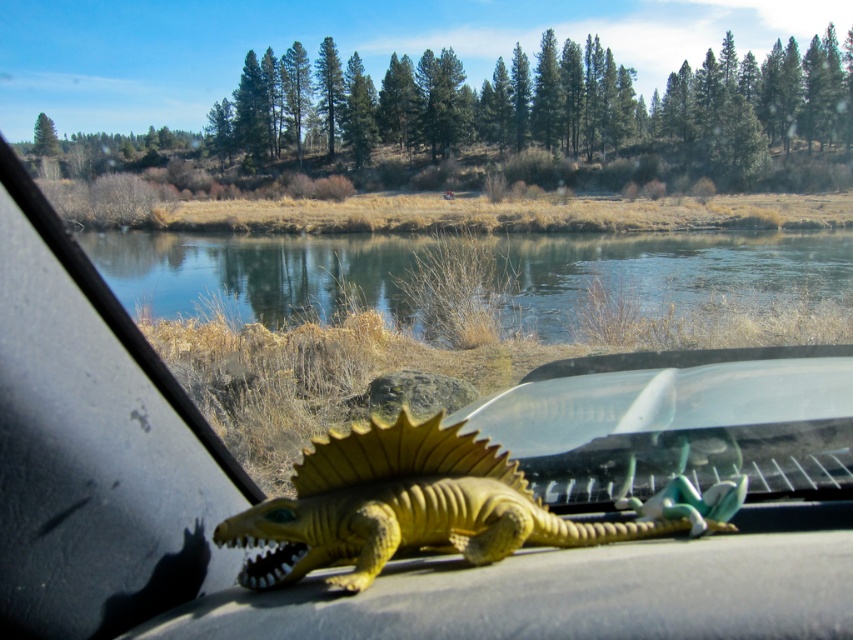
You are a passenger in the car and want to point out the clear blue water at center and the yellow matte plastic dinosaur at center to your friend. Which one is located to the left of the other?

The clear blue water at center is positioned on the left side of yellow matte plastic dinosaur at center.

You are driving and want to know if the yellow matte plastic dinosaur at center is smaller than the clear blue water at center. Can you confirm based on the scene?

The clear blue water at center is larger in size than the yellow matte plastic dinosaur at center, so yes, the yellow matte plastic dinosaur at center is smaller than the clear blue water at center.

Looking at this image, you are driving a car and want to know if the clear blue water at center is taller than the yellow matte plastic dinosaur at center. Based on the scene, can you confirm this?

The clear blue water at center has a greater height compared to the yellow matte plastic dinosaur at center, so yes, the clear blue water at center is taller than the yellow matte plastic dinosaur at center.